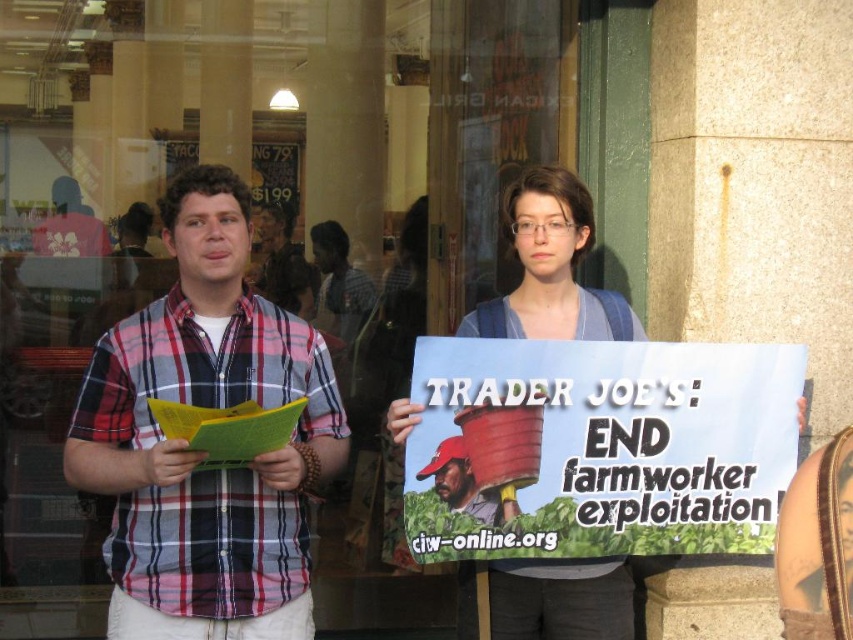
You are a photographer trying to capture both the plaid cotton shirt at left and the blue denim shirt at center in a single frame. Based on their positions and sizes, which shirt should you focus on to ensure both are clearly visible in the photo?

The plaid cotton shirt at left might be wider than blue denim shirt at center, so focusing on the plaid cotton shirt at left would help ensure both are visible as it occupies more space in the frame.